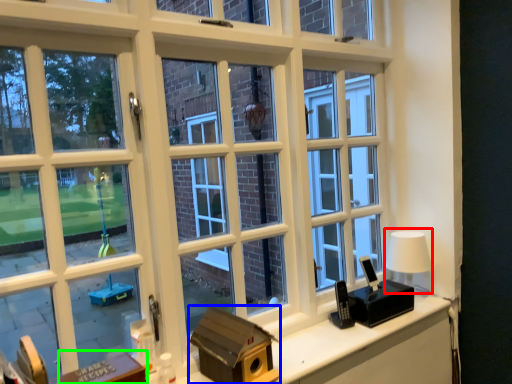
Question: Which object is positioned closest to table lamp (highlighted by a red box)? Select from box (highlighted by a blue box) and table (highlighted by a green box).

Choices:
 (A) box
 (B) table

Answer: (A)